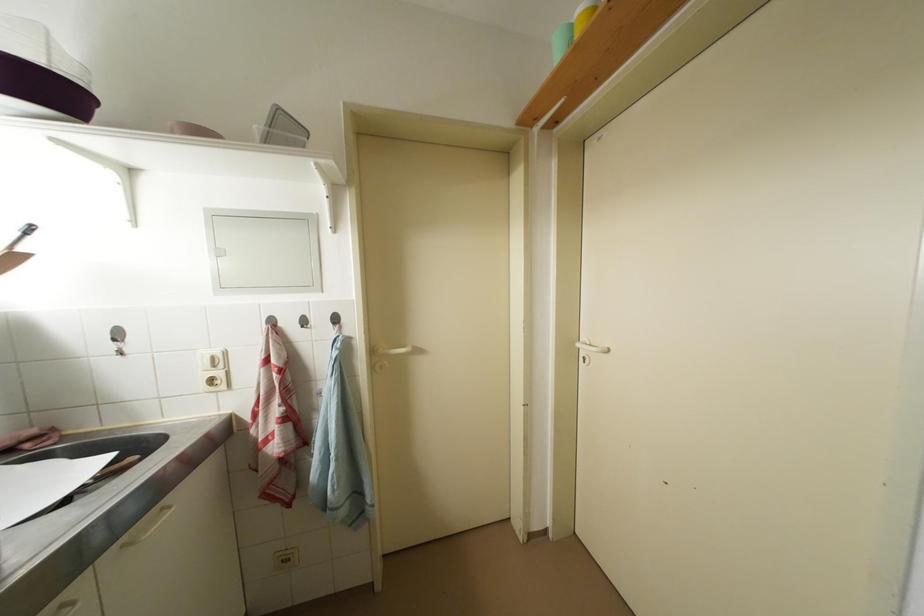
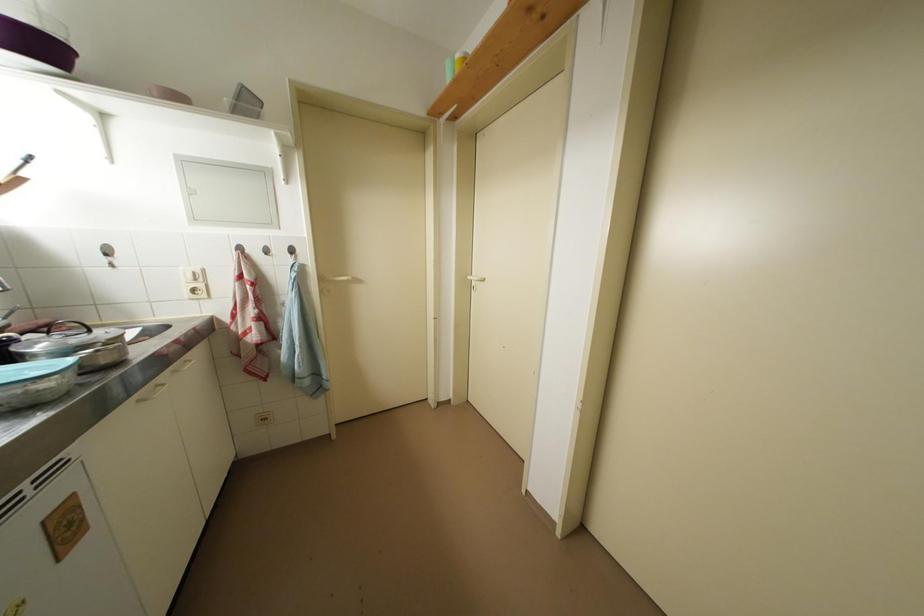
The point at (x=28, y=230) is marked in the first image. Where is the corresponding point in the second image?

(30, 160)